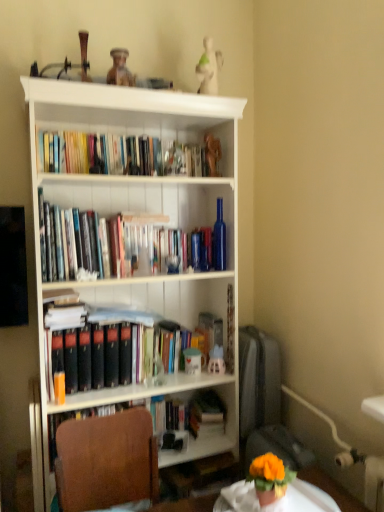
Question: Is white matte bookcase at center to the right of matte orange paperback book at left from the viewer's perspective?

Choices:
 (A) yes
 (B) no

Answer: (A)

Question: From the image's perspective, does white matte bookcase at center appear lower than matte orange paperback book at left?

Choices:
 (A) no
 (B) yes

Answer: (A)

Question: From a real-world perspective, is white matte bookcase at center under matte orange paperback book at left?

Choices:
 (A) yes
 (B) no

Answer: (B)

Question: Is white matte bookcase at center far away from matte orange paperback book at left?

Choices:
 (A) yes
 (B) no

Answer: (B)

Question: Considering the relative sizes of white matte bookcase at center and matte orange paperback book at left in the image provided, is white matte bookcase at center bigger than matte orange paperback book at left?

Choices:
 (A) yes
 (B) no

Answer: (A)

Question: From a real-world perspective, relative to matte blue toy at center, which ranks as the second toy in top-to-bottom order, is gold metallic figurine at upper center, arranged as the 2th toy when ordered from the bottom, vertically above or below?

Choices:
 (A) below
 (B) above

Answer: (B)

Question: Relative to matte blue toy at center, which ranks as the second toy in top-to-bottom order, is gold metallic figurine at upper center, the first toy in the top-to-bottom sequence, in front or behind?

Choices:
 (A) front
 (B) behind

Answer: (A)

Question: Visually, is gold metallic figurine at upper center, the first toy in the top-to-bottom sequence, positioned to the left or to the right of matte blue toy at center, which ranks as the second toy in top-to-bottom order?

Choices:
 (A) left
 (B) right

Answer: (A)

Question: Considering the positions of gold metallic figurine at upper center, the first toy in the top-to-bottom sequence, and matte blue toy at center, placed as the first toy when sorted from bottom to top, in the image, is gold metallic figurine at upper center, the first toy in the top-to-bottom sequence, taller or shorter than matte blue toy at center, placed as the first toy when sorted from bottom to top,?

Choices:
 (A) short
 (B) tall

Answer: (B)

Question: Is point (84, 509) positioned closer to the camera than point (225, 180)?

Choices:
 (A) closer
 (B) farther

Answer: (A)

Question: Is brown fabric chair at lower left to the left or to the right of white matte bookcase at center in the image?

Choices:
 (A) right
 (B) left

Answer: (A)

Question: Based on their sizes in the image, would you say brown fabric chair at lower left is bigger or smaller than white matte bookcase at center?

Choices:
 (A) big
 (B) small

Answer: (B)

Question: Is brown fabric chair at lower left situated inside white matte bookcase at center or outside?

Choices:
 (A) outside
 (B) inside

Answer: (A)

Question: From a real-world perspective, is brown fabric chair at lower left above or below white glossy round table at lower center?

Choices:
 (A) below
 (B) above

Answer: (A)

Question: In terms of height, does brown fabric chair at lower left look taller or shorter compared to white glossy round table at lower center?

Choices:
 (A) tall
 (B) short

Answer: (A)